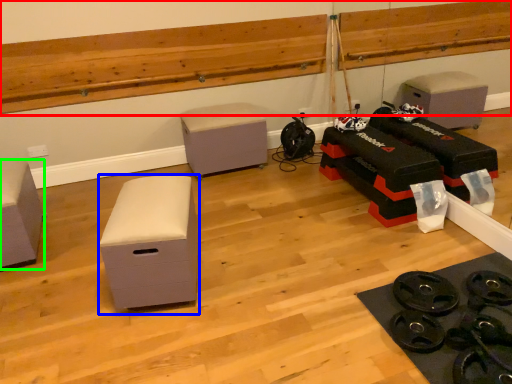
Question: Based on their relative distances, which object is farther from ledge (highlighted by a red box)? Choose from furniture (highlighted by a blue box) and furniture (highlighted by a green box).

Choices:
 (A) furniture
 (B) furniture

Answer: (A)